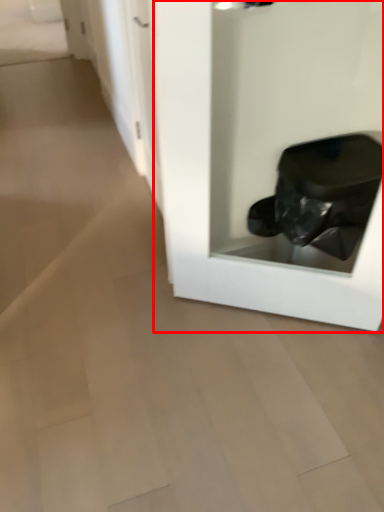
Question: From the image's perspective, what is the correct spatial positioning of glass door (annotated by the red box) in reference to door?

Choices:
 (A) above
 (B) below

Answer: (B)